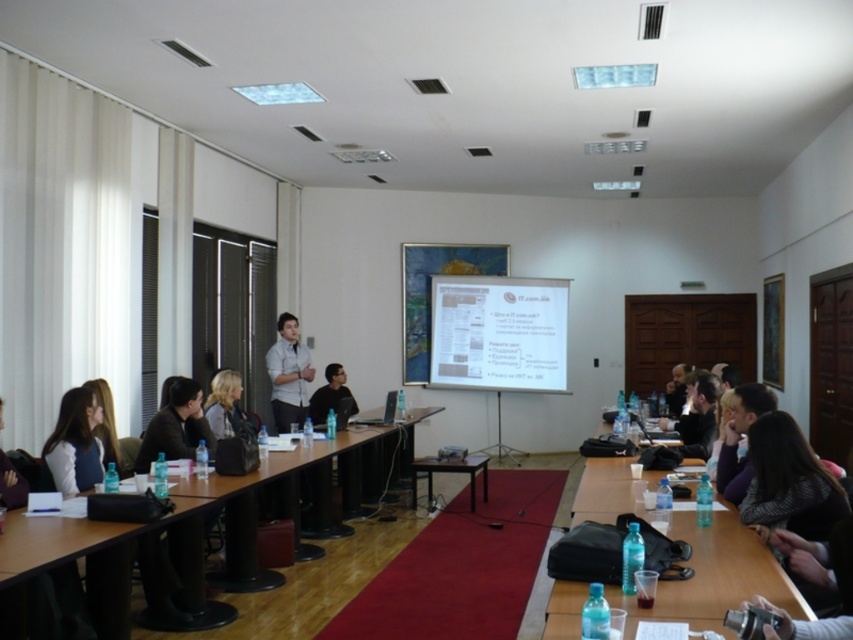
Question: Which object is closer to the camera taking this photo?

Choices:
 (A) black matte table at center
 (B) clear plastic water bottles at lower right

Answer: (B)

Question: Can you confirm if clear plastic water bottles at lower right is smaller than dark hair at center?

Choices:
 (A) no
 (B) yes

Answer: (B)

Question: Does black matte table at center have a smaller size compared to black plastic projector at center?

Choices:
 (A) yes
 (B) no

Answer: (B)

Question: In this image, where is black fabric shirt at center located relative to matte black laptop at left?

Choices:
 (A) right
 (B) left

Answer: (A)

Question: Considering the real-world distances, which object is farthest from the blonde hair at upper center?

Choices:
 (A) wooden table at lower left
 (B) dark hair at center
 (C) black fabric shirt at center
 (D) clear plastic water bottles at lower right

Answer: (B)

Question: Which object is farther from the camera taking this photo?

Choices:
 (A) matte black jacket at center
 (B) dark hair at center
 (C) matte black laptop at left
 (D) black matte table at center

Answer: (D)